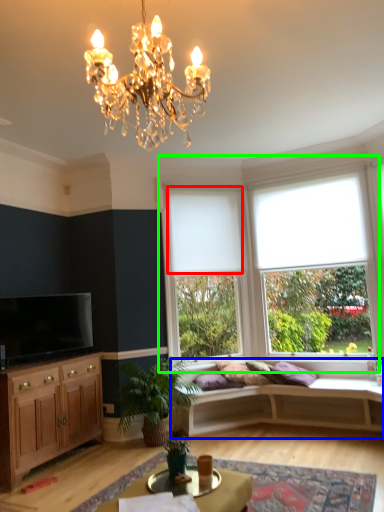
Question: Considering the real-world distances, which object is closest to blind (highlighted by a red box)? studio couch (highlighted by a blue box) or window (highlighted by a green box).

Choices:
 (A) studio couch
 (B) window

Answer: (B)